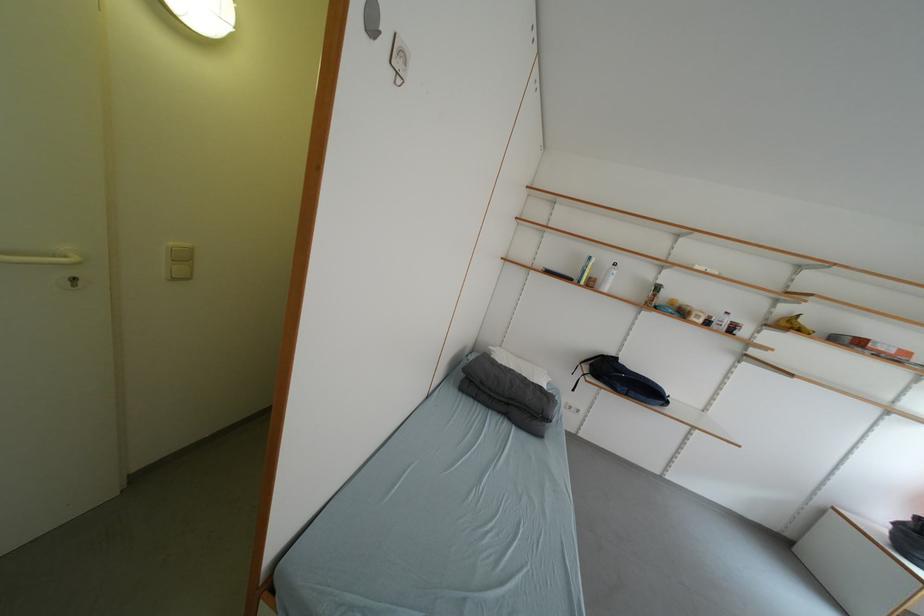
The location [793,323] corresponds to which object?

It refers to a yellow banana.